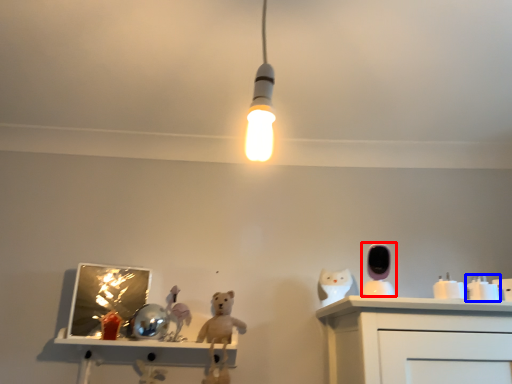
Question: Which object is further to the camera taking this photo, toy (highlighted by a red box) or toy (highlighted by a blue box)?

Choices:
 (A) toy
 (B) toy

Answer: (B)